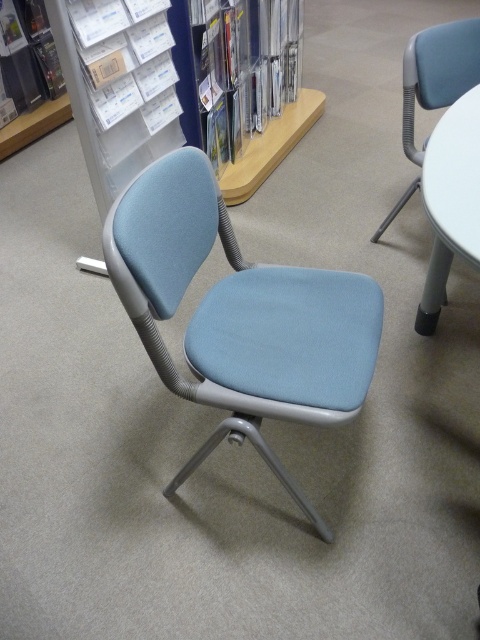
Question: Estimate the real-world distances between objects in this image. Which object is closer to the light blue fabric swivel chair at center?

Choices:
 (A) light blue fabric chair at center
 (B) white plastic table at right

Answer: (B)

Question: Does white plastic table at right have a lesser width compared to light blue fabric chair at center?

Choices:
 (A) yes
 (B) no

Answer: (B)

Question: Among these points, which one is nearest to the camera?

Choices:
 (A) (437, 177)
 (B) (286, 298)

Answer: (A)

Question: From the image, what is the correct spatial relationship of light blue fabric swivel chair at center in relation to light blue fabric chair at center?

Choices:
 (A) left
 (B) right

Answer: (A)

Question: Does light blue fabric swivel chair at center appear on the left side of light blue fabric chair at center?

Choices:
 (A) yes
 (B) no

Answer: (A)

Question: Which of the following is the farthest from the observer?

Choices:
 (A) white plastic table at right
 (B) light blue fabric chair at center
 (C) light blue fabric swivel chair at center

Answer: (B)